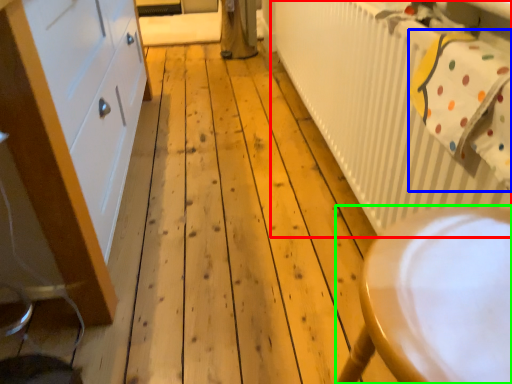
Question: Which object is positioned farthest from radiator (highlighted by a red box)? Select from laundry (highlighted by a blue box) and furniture (highlighted by a green box).

Choices:
 (A) laundry
 (B) furniture

Answer: (B)